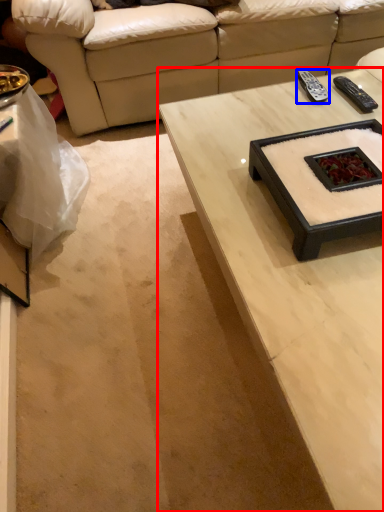
Question: Among these objects, which one is nearest to the camera, coffee table (highlighted by a red box) or remote (highlighted by a blue box)?

Choices:
 (A) coffee table
 (B) remote

Answer: (A)